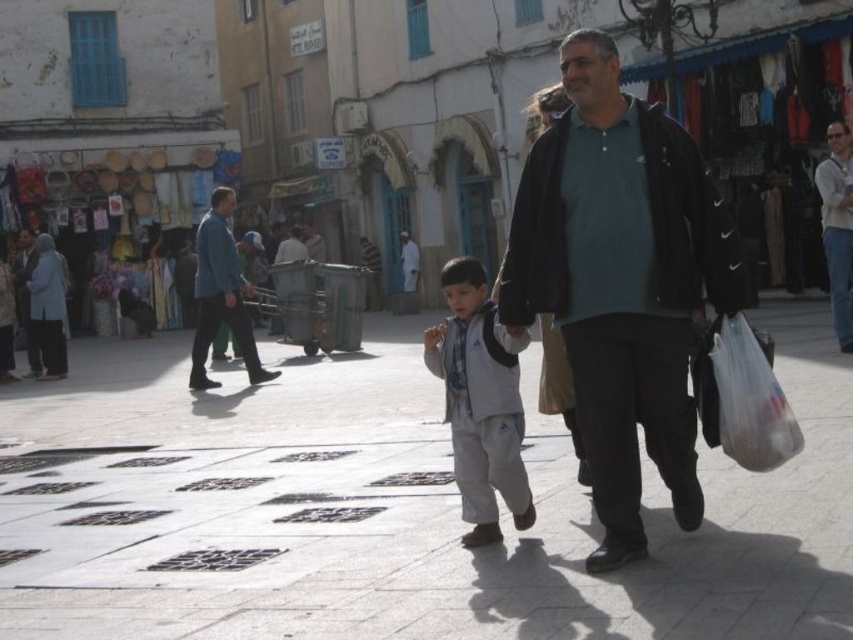
Based on the photo, please look at the image and tell me what object is located at the point with coordinates (621, 282)?

The dark green jersey at center is located at point (621, 282).